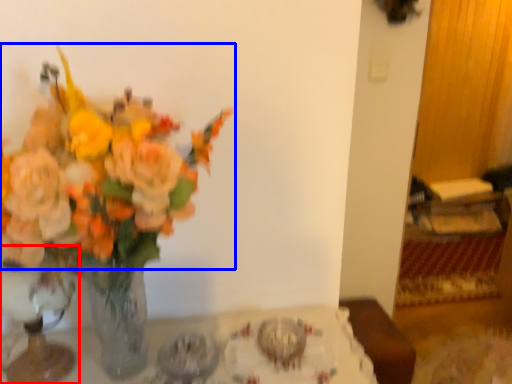
Question: Which object is further to the camera taking this photo, vase (highlighted by a red box) or flower (highlighted by a blue box)?

Choices:
 (A) vase
 (B) flower

Answer: (A)